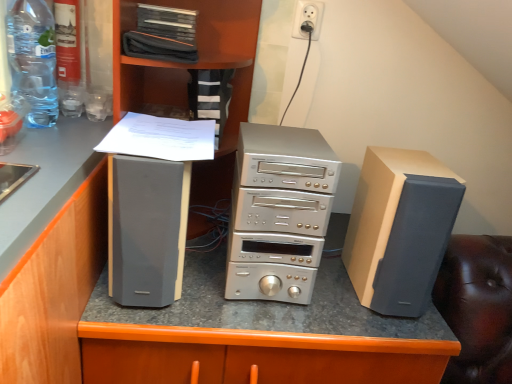
Question: Is matte gray speaker at left far away from silver metallic stereo stack at center?

Choices:
 (A) no
 (B) yes

Answer: (A)

Question: Can you see matte gray speaker at left touching silver metallic stereo stack at center?

Choices:
 (A) no
 (B) yes

Answer: (A)

Question: From the image's perspective, is matte gray speaker at left above silver metallic stereo stack at center?

Choices:
 (A) yes
 (B) no

Answer: (A)

Question: From a real-world perspective, is matte gray speaker at left under silver metallic stereo stack at center?

Choices:
 (A) yes
 (B) no

Answer: (A)

Question: From the image's perspective, would you say matte gray speaker at left is shown under silver metallic stereo stack at center?

Choices:
 (A) yes
 (B) no

Answer: (B)

Question: Can we say matte gray speaker at left lies outside silver metallic stereo stack at center?

Choices:
 (A) no
 (B) yes

Answer: (B)

Question: Is satin silver electronics at center closer to camera compared to black fabric case at upper center?

Choices:
 (A) no
 (B) yes

Answer: (B)

Question: Does satin silver electronics at center have a lesser width compared to black fabric case at upper center?

Choices:
 (A) yes
 (B) no

Answer: (B)

Question: Considering the relative sizes of satin silver electronics at center and black fabric case at upper center in the image provided, is satin silver electronics at center wider than black fabric case at upper center?

Choices:
 (A) yes
 (B) no

Answer: (A)

Question: Does satin silver electronics at center have a lesser height compared to black fabric case at upper center?

Choices:
 (A) no
 (B) yes

Answer: (A)

Question: Is satin silver electronics at center turned away from black fabric case at upper center?

Choices:
 (A) yes
 (B) no

Answer: (B)

Question: Is the position of satin silver electronics at center more distant than that of black fabric case at upper center?

Choices:
 (A) yes
 (B) no

Answer: (B)

Question: From the image's perspective, is white paper at center above matte gray speaker at left?

Choices:
 (A) yes
 (B) no

Answer: (A)